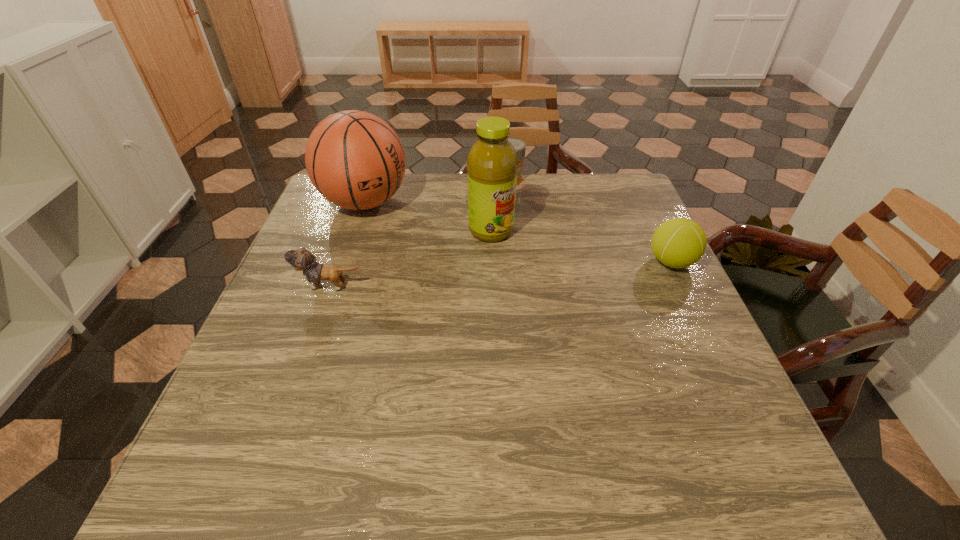
Where is `object situated at the right edge`? The image size is (960, 540). object situated at the right edge is located at coordinates (679, 242).

Image resolution: width=960 pixels, height=540 pixels. Identify the location of object located at the far left corner. (354, 159).

The height and width of the screenshot is (540, 960). Find the location of `vacant area at the far edge`. vacant area at the far edge is located at coordinates (378, 213).

This screenshot has width=960, height=540. I want to click on free region at the near edge of the desktop, so click(x=324, y=418).

Where is `free region at the right edge of the desktop`? The image size is (960, 540). free region at the right edge of the desktop is located at coordinates (616, 253).

At what (x,y) coordinates should I click in order to perform the action: click on vacant space at the far right corner of the desktop. Please return your answer as a coordinate pair (x, y). This screenshot has height=540, width=960. Looking at the image, I should click on (622, 187).

Identify the location of vacant area between the fruit juice and the basketball. (428, 217).

Identify the location of vacant area that lies between the kitten and the basketball. (348, 244).

This screenshot has height=540, width=960. Find the location of `empty space that is in between the kitten and the basketball`. empty space that is in between the kitten and the basketball is located at coordinates (348, 244).

What are the coordinates of `vacant space that's between the medicine and the rightmost object` in the screenshot? It's located at (591, 221).